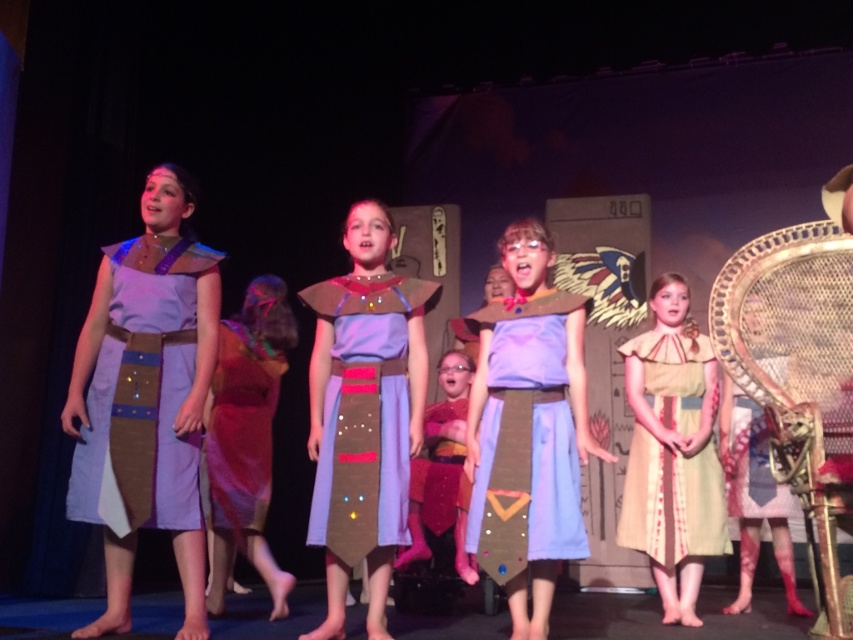
Question: Is matte purple fabric dress at left smaller than matte fabric dress at center?

Choices:
 (A) no
 (B) yes

Answer: (B)

Question: Estimate the real-world distances between objects in this image. Which object is closer to the matte purple fabric dress at left?

Choices:
 (A) light brown fabric dress at center
 (B) light blue fabric dress at center
 (C) shiny orange dress at center
 (D) matte fabric dress at center

Answer: (D)

Question: Among these points, which one is nearest to the camera?

Choices:
 (A) (230, 392)
 (B) (392, 403)

Answer: (B)

Question: Which object is positioned farthest from the light blue fabric dress at center?

Choices:
 (A) matte purple fabric dress at left
 (B) matte fabric dress at center

Answer: (A)

Question: Can you confirm if light blue fabric dress at center is thinner than light brown fabric dress at center?

Choices:
 (A) yes
 (B) no

Answer: (A)

Question: Does matte purple fabric dress at left appear over light blue fabric dress at center?

Choices:
 (A) no
 (B) yes

Answer: (B)